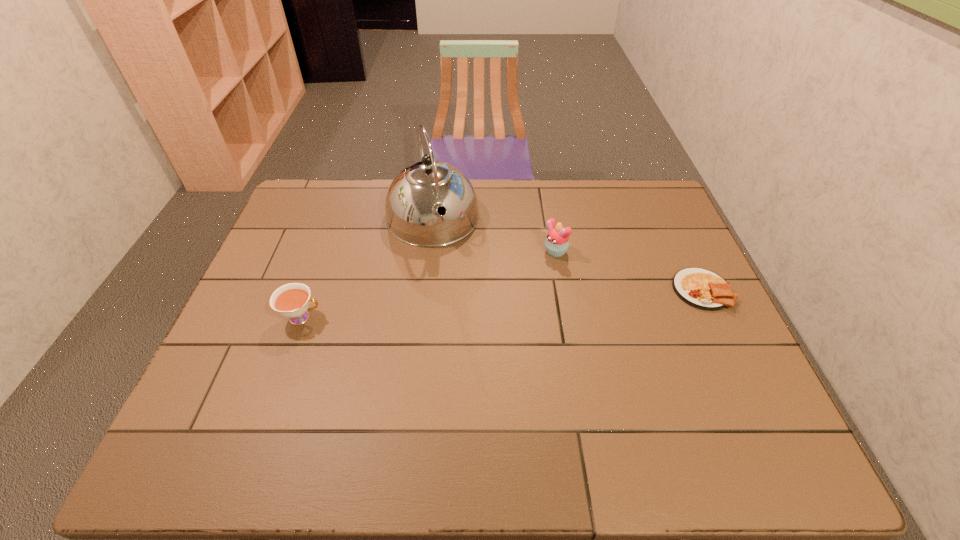
This screenshot has height=540, width=960. What are the coordinates of `free space on the desktop that is between the leftmost object and the rightmost object and is positioned from the spout of the kettle` in the screenshot? It's located at (464, 307).

The image size is (960, 540). Find the location of `free space on the desktop that is between the teacup and the rightmost object and is positioned on the face of the second tallest object`. free space on the desktop that is between the teacup and the rightmost object and is positioned on the face of the second tallest object is located at coordinates (477, 306).